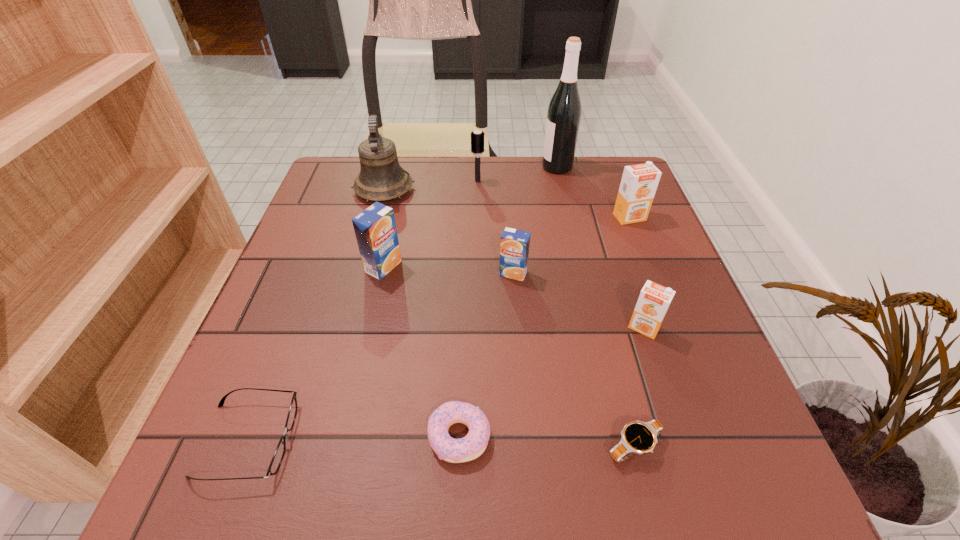
The height and width of the screenshot is (540, 960). In order to click on doughnut present at the near edge in this screenshot , I will do `click(470, 447)`.

At what (x,y) coordinates should I click in order to perform the action: click on spectacles present at the near edge. Please return your answer as a coordinate pair (x, y). The height and width of the screenshot is (540, 960). Looking at the image, I should click on (277, 458).

Image resolution: width=960 pixels, height=540 pixels. Find the location of `watch that is at the near edge`. watch that is at the near edge is located at coordinates (638, 437).

Locate an element on the screen. The width and height of the screenshot is (960, 540). bell that is at the left edge is located at coordinates (381, 178).

Where is `spectacles located in the left edge section of the desktop`? The image size is (960, 540). spectacles located in the left edge section of the desktop is located at coordinates (277, 458).

Image resolution: width=960 pixels, height=540 pixels. What are the coordinates of `watch that is at the right edge` in the screenshot? It's located at (638, 437).

Where is `object that is at the far left corner`? The width and height of the screenshot is (960, 540). object that is at the far left corner is located at coordinates (381, 178).

The image size is (960, 540). Find the location of `object that is at the near left corner`. object that is at the near left corner is located at coordinates (277, 458).

Where is `object located in the near right corner section of the desktop`? This screenshot has width=960, height=540. object located in the near right corner section of the desktop is located at coordinates (638, 437).

You are a GUI agent. You are given a task and a screenshot of the screen. Output one action in this format:
    pyautogui.click(x=<x>, y=<y>)
    Task: Click on the free space at the far edge
    
    Given the screenshot: What is the action you would take?
    pyautogui.click(x=440, y=159)